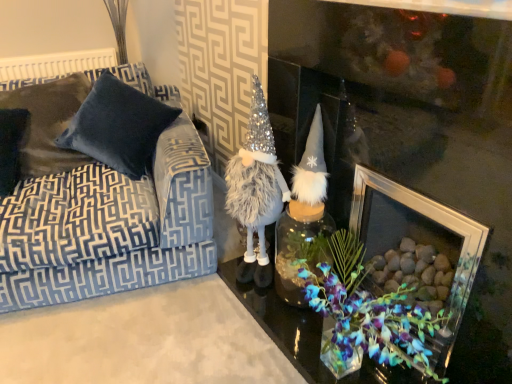
I want to click on vacant space in front of fuzzy silver/grey gnome at center, so click(232, 316).